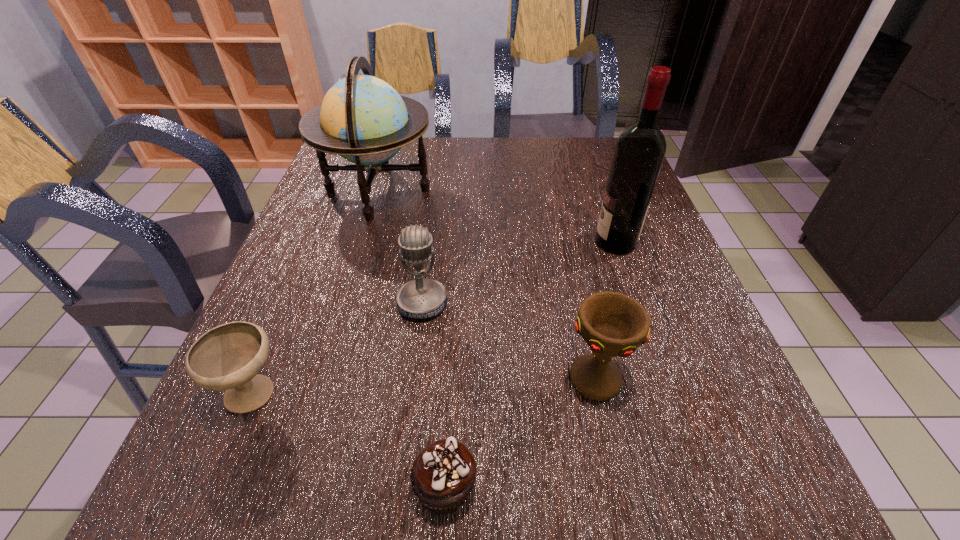
Where is `cupcake`? The height and width of the screenshot is (540, 960). cupcake is located at coordinates click(442, 476).

The image size is (960, 540). Find the location of `the shortest object`. the shortest object is located at coordinates (442, 476).

Locate an element on the screen. vacant space located 0.360m on the front and back of the fifth nearest object is located at coordinates (443, 242).

At what (x,y) coordinates should I click in order to perform the action: click on blank space located on the front and back of the fifth nearest object. Please return your answer as a coordinate pair (x, y). Looking at the image, I should click on (460, 242).

Image resolution: width=960 pixels, height=540 pixels. Identify the location of free space located 0.230m on the front and back of the fifth nearest object. (497, 242).

Locate an element on the screen. The height and width of the screenshot is (540, 960). blank area located 0.070m on the surface of the fifth shortest object is located at coordinates (460, 191).

The width and height of the screenshot is (960, 540). In order to click on free space located 0.190m on the front-facing side of the fourth nearest object in this screenshot , I will do `click(409, 411)`.

Where is `vacant space located 0.380m on the back of the fourth tallest object`? This screenshot has width=960, height=540. vacant space located 0.380m on the back of the fourth tallest object is located at coordinates (562, 227).

At what (x,y) coordinates should I click in order to perform the action: click on vacant space located 0.370m on the back of the shorter chalice. Please return your answer as a coordinate pair (x, y). Looking at the image, I should click on (319, 237).

Find the location of `vacant region located 0.230m on the left of the shortest object`. vacant region located 0.230m on the left of the shortest object is located at coordinates (254, 487).